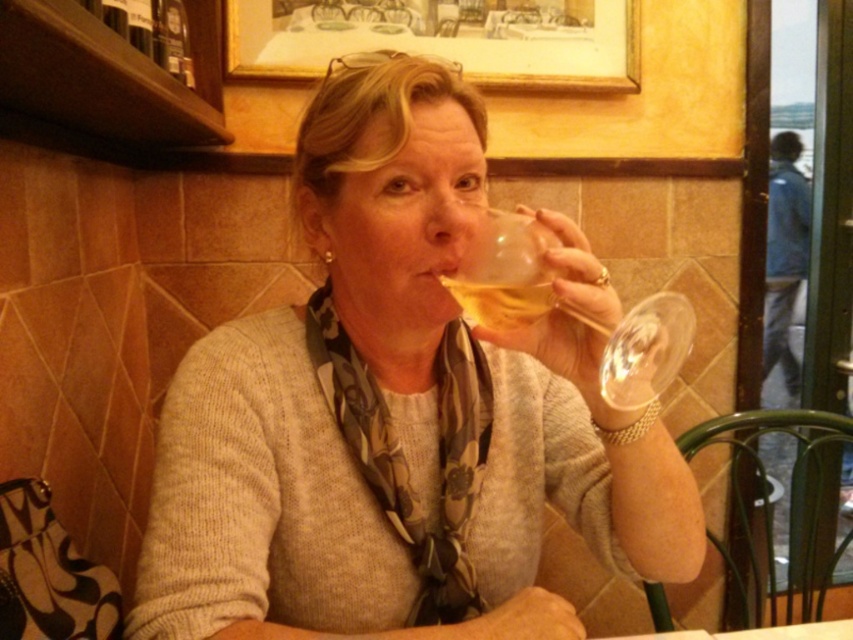
Question: Is the position of matte glass at center less distant than that of wooden frame at upper center?

Choices:
 (A) no
 (B) yes

Answer: (B)

Question: Among these points, which one is nearest to the camera?

Choices:
 (A) (608, 342)
 (B) (122, 0)
 (C) (508, 61)
 (D) (506, 289)

Answer: (A)

Question: Can you confirm if matte glass at center is positioned to the right of matte glass bottle at upper left?

Choices:
 (A) no
 (B) yes

Answer: (B)

Question: Which point is closer to the camera?

Choices:
 (A) (515, 250)
 (B) (254, 1)
 (C) (177, 19)

Answer: (A)

Question: Is wooden frame at upper center above matte glass bottle at upper left?

Choices:
 (A) yes
 (B) no

Answer: (A)

Question: Considering the real-world distances, which object is closest to the wooden frame at upper center?

Choices:
 (A) transparent glass at upper center
 (B) matte glass bottle at upper left
 (C) matte glass at center

Answer: (B)